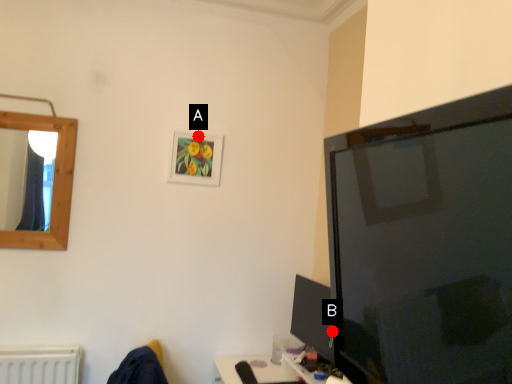
Question: Two points are circled on the image, labeled by A and B beside each circle. Which point is closer to the camera?

Choices:
 (A) A is closer
 (B) B is closer

Answer: (B)